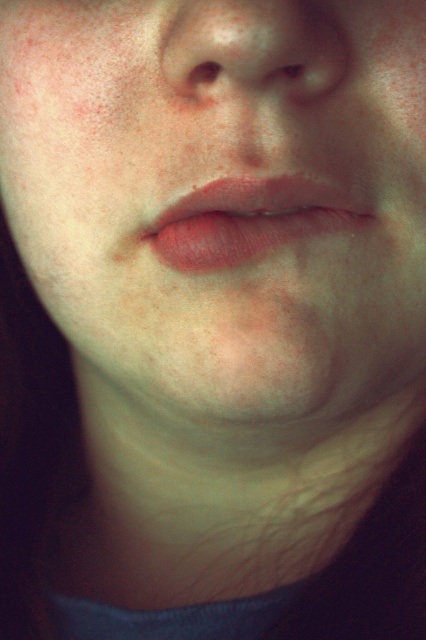
Question: Does smooth skin at center have a smaller size compared to smooth skin nose at center?

Choices:
 (A) yes
 (B) no

Answer: (B)

Question: Which point appears farthest from the camera in this image?

Choices:
 (A) (276, 320)
 (B) (233, 6)
 (C) (319, 208)
 (D) (296, 67)

Answer: (C)

Question: Does smooth skin at center appear under matte skin eye at upper center?

Choices:
 (A) no
 (B) yes

Answer: (B)

Question: Which of these objects is positioned farthest from the matte skin eye at upper center?

Choices:
 (A) matte pink lips at center
 (B) smooth skin at center

Answer: (B)

Question: Which point is farther to the camera?

Choices:
 (A) (54, 218)
 (B) (299, 65)
 (C) (313, 224)
 (D) (203, 61)

Answer: (A)

Question: Can you confirm if matte pink lips at center is bigger than matte skin eye at upper center?

Choices:
 (A) no
 (B) yes

Answer: (B)